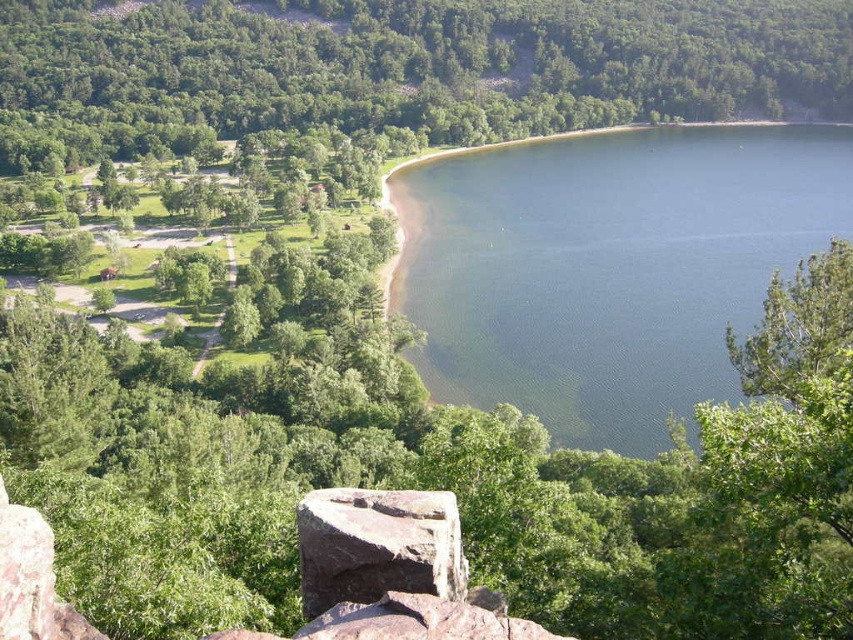
Question: Which point is farther to the camera?

Choices:
 (A) green smooth water at center
 (B) green leafy tree at upper left
 (C) green leafy tree at right
 (D) gray rough rock at center

Answer: (B)

Question: Does green leafy tree at upper left appear over gray rough rock at center?

Choices:
 (A) yes
 (B) no

Answer: (A)

Question: Does green leafy tree at upper left lie in front of gray rough rock at center?

Choices:
 (A) yes
 (B) no

Answer: (B)

Question: Which point is farther from the camera taking this photo?

Choices:
 (A) (849, 268)
 (B) (494, 365)
 (C) (412, 528)

Answer: (B)

Question: Which of the following is the farthest from the observer?

Choices:
 (A) green leafy tree at right
 (B) green smooth water at center

Answer: (B)

Question: Can you confirm if gray rough rock at center is positioned to the right of green leafy tree at right?

Choices:
 (A) yes
 (B) no

Answer: (B)